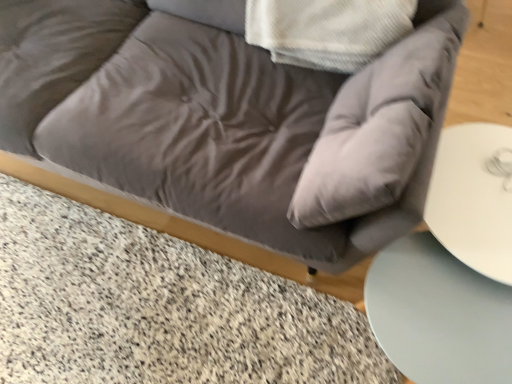
Question: Considering the positions of granite textured marble at lower left and smooth white table at lower right in the image, is granite textured marble at lower left taller or shorter than smooth white table at lower right?

Choices:
 (A) short
 (B) tall

Answer: (A)

Question: From the image's perspective, relative to smooth white table at lower right, is granite textured marble at lower left above or below?

Choices:
 (A) above
 (B) below

Answer: (A)

Question: Which object is positioned closest to the satin gray couch at center?

Choices:
 (A) smooth white table at lower right
 (B) granite textured marble at lower left

Answer: (A)

Question: Estimate the real-world distances between objects in this image. Which object is closer to the satin gray couch at center?

Choices:
 (A) smooth white table at lower right
 (B) granite textured marble at lower left

Answer: (A)